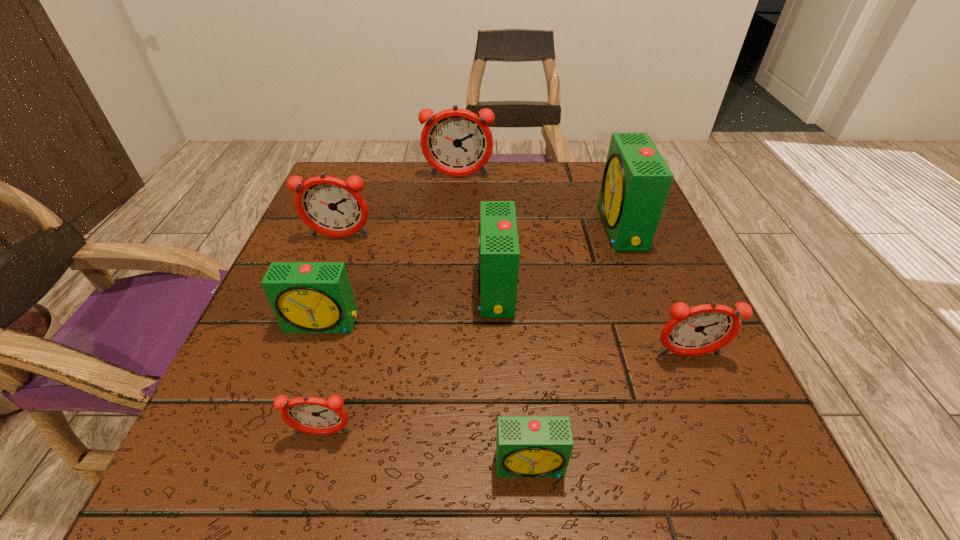
This screenshot has width=960, height=540. I want to click on free space at the near left corner of the desktop, so click(x=208, y=495).

The image size is (960, 540). Find the location of `vacant space at the far right corner of the desktop`. vacant space at the far right corner of the desktop is located at coordinates (584, 197).

You are a GUI agent. You are given a task and a screenshot of the screen. Output one action in this format:
    pyautogui.click(x=<x>, y=<y>)
    Task: Click on the vacant region between the third nearest reddish-pink alarm clock and the farthest alarm clock
    
    Given the screenshot: What is the action you would take?
    pyautogui.click(x=398, y=207)

The width and height of the screenshot is (960, 540). In order to click on free space between the third nearest object and the rightmost green alarm clock in this screenshot , I will do `click(655, 291)`.

Locate an element on the screen. The height and width of the screenshot is (540, 960). free area in between the second nearest alarm clock and the leftmost green alarm clock is located at coordinates (323, 378).

Where is `vacant space in between the biggest reddish-pink alarm clock and the leftmost green alarm clock`? This screenshot has height=540, width=960. vacant space in between the biggest reddish-pink alarm clock and the leftmost green alarm clock is located at coordinates (391, 250).

This screenshot has width=960, height=540. In order to click on blank region between the nearest reddish-pink alarm clock and the third smallest green alarm clock in this screenshot , I will do `click(409, 362)`.

The height and width of the screenshot is (540, 960). What are the coordinates of `free spot between the second biggest green alarm clock and the third nearest reddish-pink alarm clock` in the screenshot? It's located at (418, 264).

You are a GUI agent. You are given a task and a screenshot of the screen. Output one action in this format:
    pyautogui.click(x=<x>, y=<y>)
    Task: Click on the free space between the third smallest reddish-pink alarm clock and the biggest reddish-pink alarm clock
    This screenshot has width=960, height=540.
    Given the screenshot: What is the action you would take?
    pyautogui.click(x=398, y=207)

The width and height of the screenshot is (960, 540). I want to click on free space between the farthest green alarm clock and the third farthest reddish-pink alarm clock, so click(x=655, y=291).